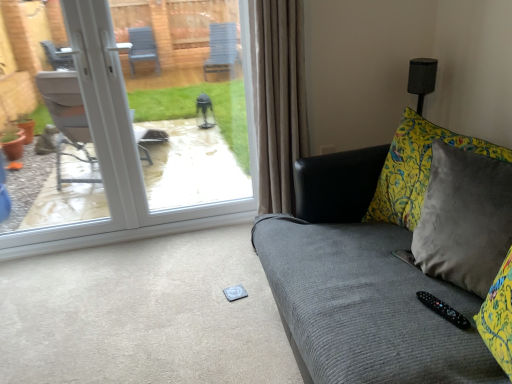
Question: Considering the relative sizes of white plastic door at upper left and black plastic remote at lower right in the image provided, is white plastic door at upper left thinner than black plastic remote at lower right?

Choices:
 (A) no
 (B) yes

Answer: (A)

Question: Does white plastic door at upper left have a greater height compared to black plastic remote at lower right?

Choices:
 (A) no
 (B) yes

Answer: (B)

Question: Is white plastic door at upper left to the right of black plastic remote at lower right from the viewer's perspective?

Choices:
 (A) yes
 (B) no

Answer: (B)

Question: Is white plastic door at upper left positioned before black plastic remote at lower right?

Choices:
 (A) yes
 (B) no

Answer: (B)

Question: Is white plastic door at upper left not near black plastic remote at lower right?

Choices:
 (A) yes
 (B) no

Answer: (A)

Question: Considering the relative positions of white plastic door at upper left and black plastic remote at lower right in the image provided, is white plastic door at upper left behind black plastic remote at lower right?

Choices:
 (A) no
 (B) yes

Answer: (B)

Question: Considering the relative sizes of black plastic remote at lower right and white plastic door at upper left in the image provided, is black plastic remote at lower right smaller than white plastic door at upper left?

Choices:
 (A) yes
 (B) no

Answer: (A)

Question: Considering the relative positions of black plastic remote at lower right and white plastic door at upper left in the image provided, is black plastic remote at lower right to the right of white plastic door at upper left from the viewer's perspective?

Choices:
 (A) no
 (B) yes

Answer: (B)

Question: Is black plastic remote at lower right in front of white plastic door at upper left?

Choices:
 (A) no
 (B) yes

Answer: (B)

Question: Is black plastic remote at lower right far from white plastic door at upper left?

Choices:
 (A) yes
 (B) no

Answer: (A)

Question: Considering the relative sizes of black plastic remote at lower right and white plastic door at upper left in the image provided, is black plastic remote at lower right bigger than white plastic door at upper left?

Choices:
 (A) yes
 (B) no

Answer: (B)

Question: Is white plastic door at upper left located within black plastic remote at lower right?

Choices:
 (A) no
 (B) yes

Answer: (A)

Question: Can you confirm if velvet gray couch at right is wider than black plastic remote at lower right?

Choices:
 (A) yes
 (B) no

Answer: (A)